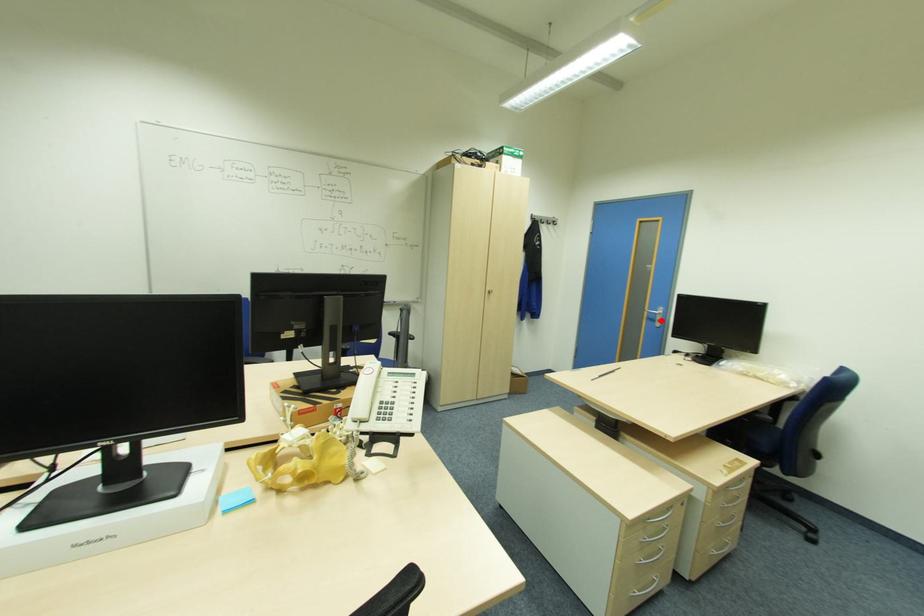
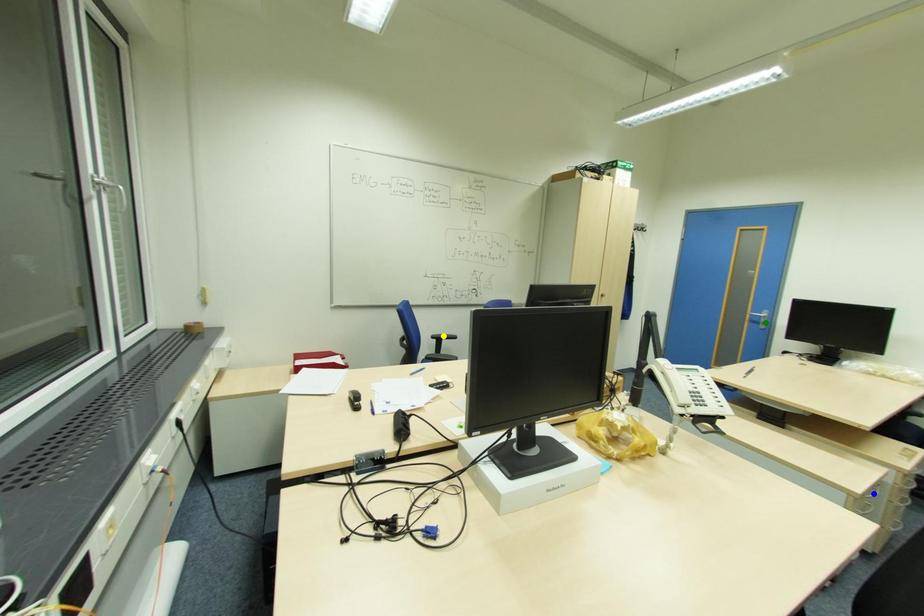
Question: I am providing you with two images of the same scene from different viewpoints. A red point is marked on the first image. You are given multiple points on the second image. Which spot in image 2 lines up with the point in image 1?

Choices:
 (A) yellow point
 (B) green point
 (C) blue point

Answer: (B)